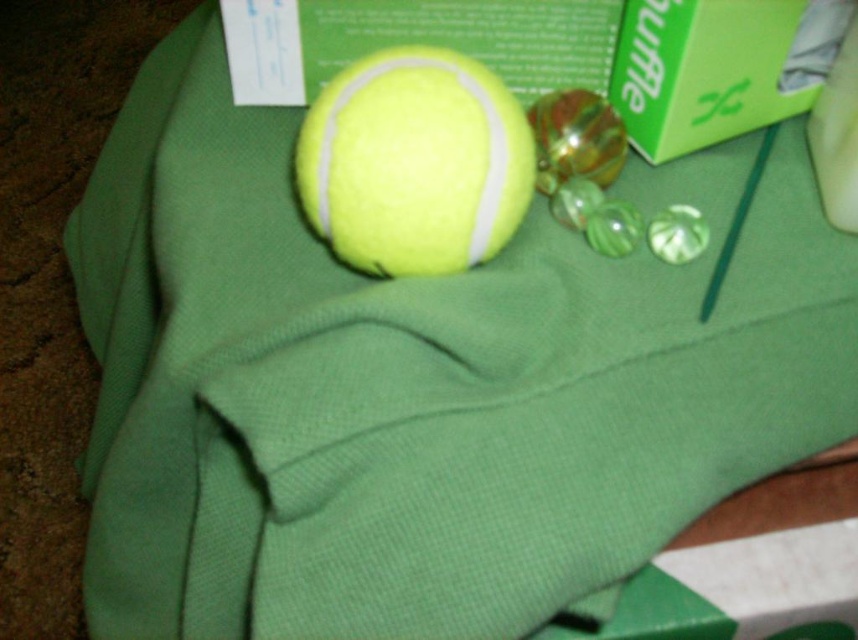
You are looking at the image and want to place a sticker on the point that is closer to you. Which point should you choose between point (442,225) and point (781,26)?

Point (442,225) is in front of point (781,26), so you should choose point (442,225) to place the sticker as it is closer to you.

You are organizing a toy store and need to place the yellow matte tennis ball at center and the green cardboard box at upper right on a shelf. Given their sizes, which one should you place first to ensure stability?

The yellow matte tennis ball at center is bigger than the green cardboard box at upper right, so you should place the yellow matte tennis ball at center first to ensure stability as larger items are typically placed first to prevent toppling smaller items.

You are holding a camera and want to take a photo of the yellow matte tennis ball at center. If your camera requires the subject to be at least 18 inches away to focus properly, will you need to move closer or farther away?

The yellow matte tennis ball at center is currently 16.47 inches away from the camera, which is closer than the required 18 inches. You need to move farther away to ensure proper focus.